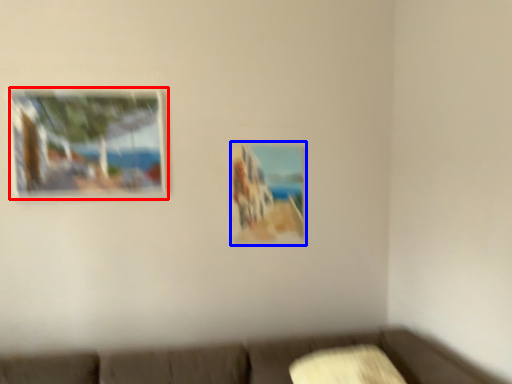
Question: Which object appears closest to the camera in this image, picture frame (highlighted by a red box) or picture frame (highlighted by a blue box)?

Choices:
 (A) picture frame
 (B) picture frame

Answer: (A)